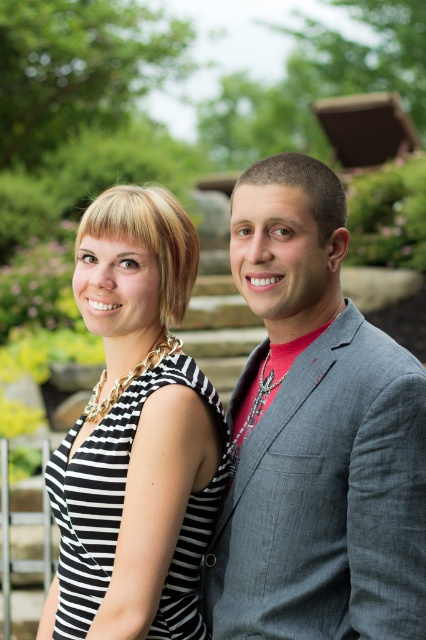
You are a photographer preparing to take a portrait of the two people in the scene. You want to ensure that the gray textured blazer at right is in focus while keeping the background slightly blurred. Given that the camera can only focus on objects within 7 feet from the lens, will the blazer be in focus?

The gray textured blazer at right is 7.49 feet away from the camera. Since the camera can only focus on objects within 7 feet, the blazer will be slightly out of focus.

You are a fashion stylist trying to create a coordinated outfit. You have a gray textured blazer at right and a black striped fabric dress at center. Which item is bigger in size?

The gray textured blazer at right has a larger size compared to the black striped fabric dress at center.

You are a fashion photographer who wants to capture a dynamic shot of the gray textured blazer at right and the black striped fabric dress at center. To create a sense of movement, you need to position the blazer closer to the viewer than the dress. Is this arrangement possible based on their current positions?

The gray textured blazer at right is positioned on the right side of the black striped fabric dress at center, so it is already closer to the viewer than the dress. Therefore, this arrangement is possible.